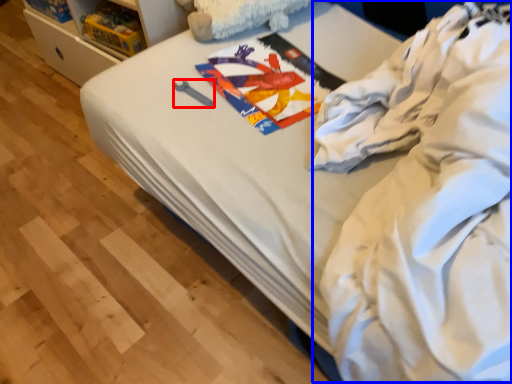
Question: Which point is closer to the camera, equipment (highlighted by a red box) or clothing (highlighted by a blue box)?

Choices:
 (A) equipment
 (B) clothing

Answer: (B)